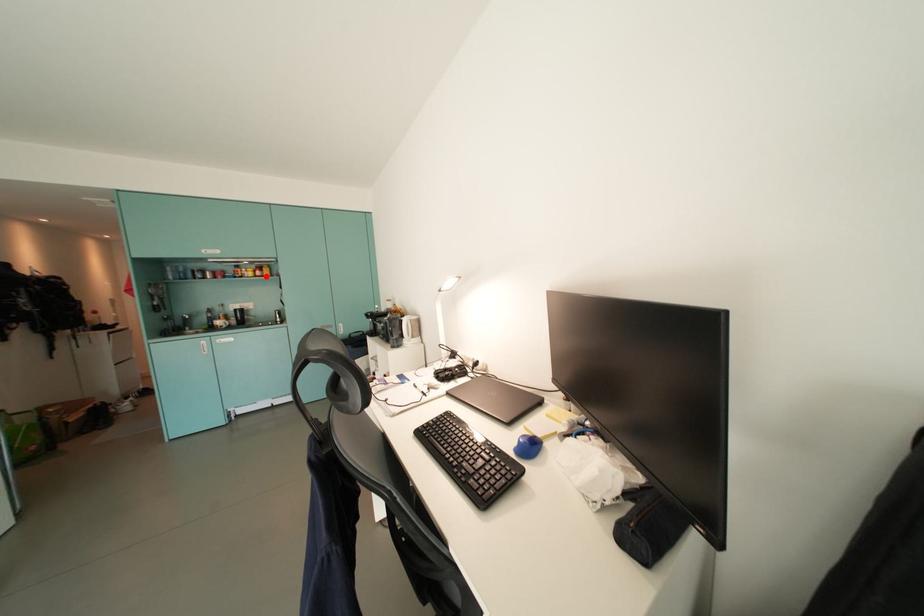
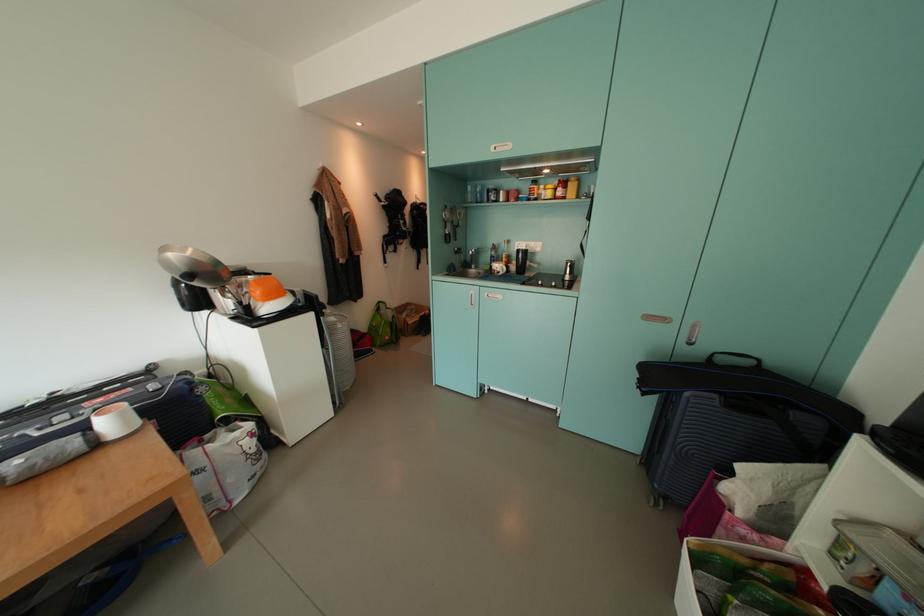
Find the pixel in the second image that matches the highlighted location in the first image.

(566, 195)